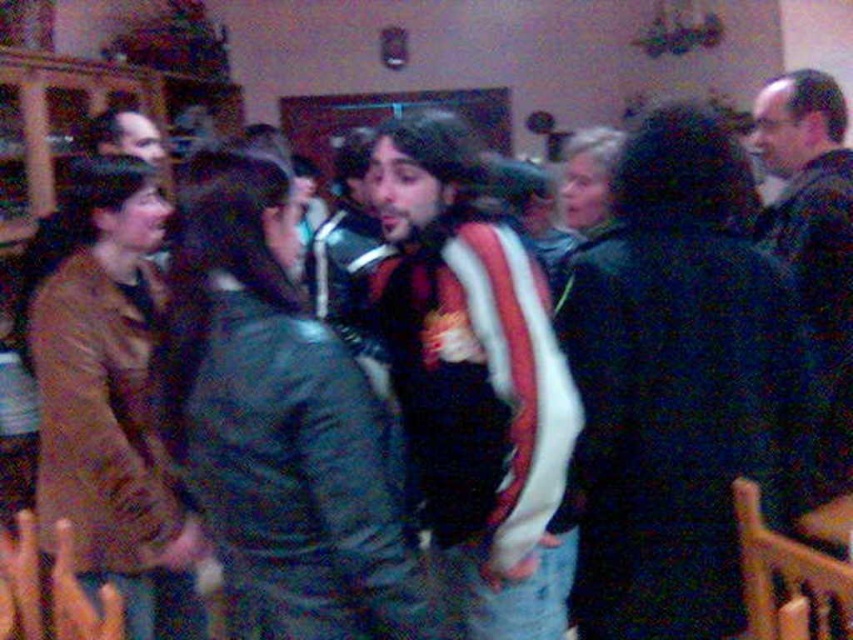
Question: Is striped sweater at center positioned at the back of dark green sweater at center?

Choices:
 (A) no
 (B) yes

Answer: (A)

Question: Which object is farther from the camera taking this photo?

Choices:
 (A) dark green sweater at center
 (B) striped sweater at center

Answer: (A)

Question: Which of the following is the farthest from the observer?

Choices:
 (A) [x=457, y=568]
 (B) [x=851, y=237]

Answer: (B)

Question: Is striped sweater at center positioned before dark green sweater at center?

Choices:
 (A) yes
 (B) no

Answer: (A)

Question: Can you confirm if striped sweater at center is positioned below dark green sweater at center?

Choices:
 (A) yes
 (B) no

Answer: (A)